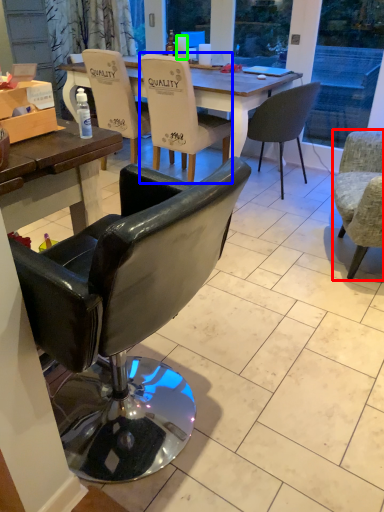
Question: Which object is the farthest from chair (highlighted by a red box)? Choose among these: chair (highlighted by a blue box) or coffee cup (highlighted by a green box).

Choices:
 (A) chair
 (B) coffee cup

Answer: (B)